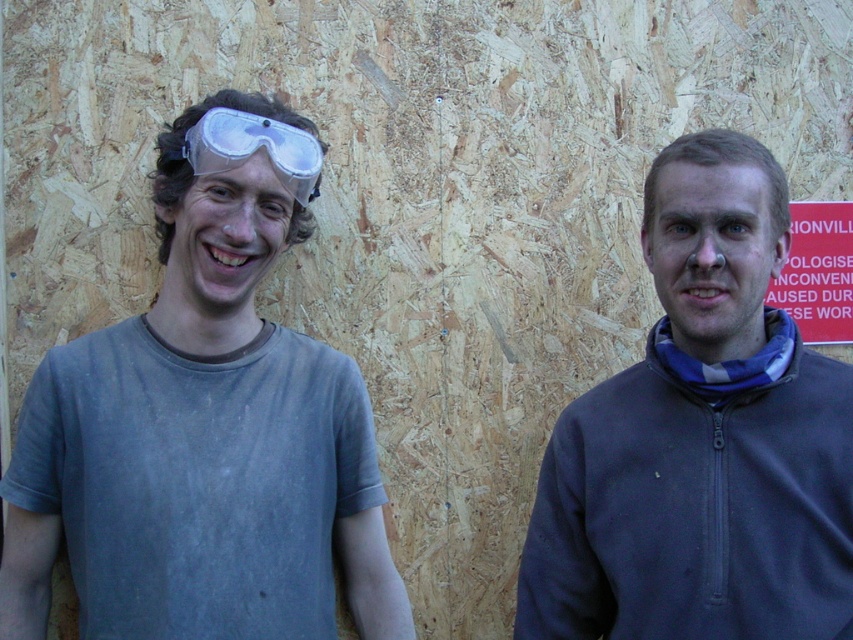
You are a construction worker standing in front of the OSB panels. You need to place a new red plastic sign at right so it is visible from the entrance. The dark gray fleece at right is currently blocking the view. Can you move the sign to a position where it is still at the right but not blocked by the fleece?

The dark gray fleece at right is closer to the viewer than the red plastic sign at right. To make the sign visible, move the red plastic sign at right in front of the dark gray fleece at right so it is closer to the viewer than the fleece.

You are a safety inspector and need to ensure that the distance between the dark gray fleece at right and the transparent plastic goggles at left meets the minimum safety requirement of 20 inches. Can you confirm if the distance is sufficient?

The dark gray fleece at right is 21.33 inches from the transparent plastic goggles at left, which exceeds the minimum requirement of 20 inches. Therefore, the distance is sufficient.